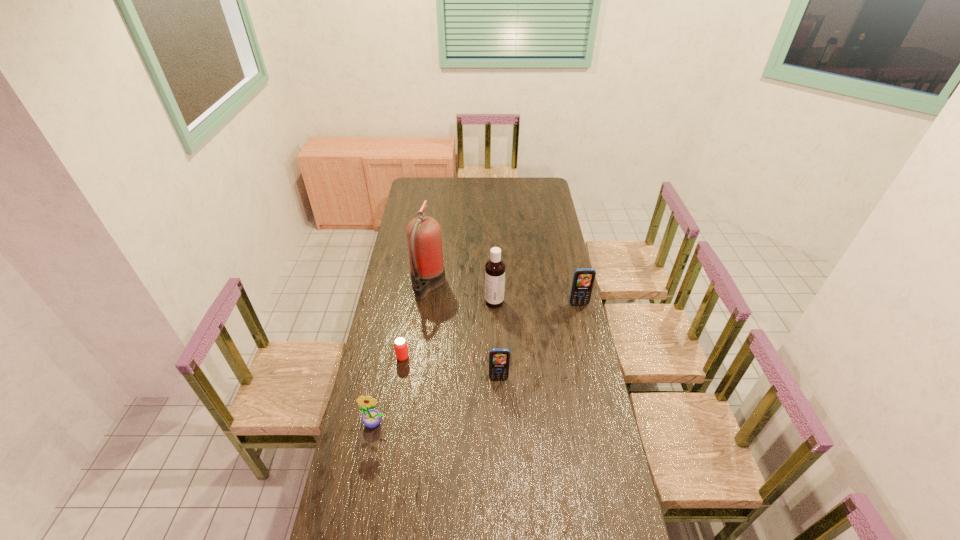
Where is `the shorter cellular telephone`? The width and height of the screenshot is (960, 540). the shorter cellular telephone is located at coordinates (499, 358).

Find the location of a particular element. the second nearest object is located at coordinates click(499, 358).

Where is `the farther cellular telephone`? This screenshot has height=540, width=960. the farther cellular telephone is located at coordinates (583, 280).

You are a GUI agent. You are given a task and a screenshot of the screen. Output one action in this format:
    pyautogui.click(x=<x>, y=<y>)
    Task: Click on the taller cellular telephone
    
    Given the screenshot: What is the action you would take?
    pyautogui.click(x=583, y=280)

At what (x,y) coordinates should I click in order to perform the action: click on dishwasher detergent. Please return your answer as a coordinate pair (x, y). This screenshot has height=540, width=960. Looking at the image, I should click on (495, 267).

This screenshot has width=960, height=540. What are the coordinates of `fire extinguisher` in the screenshot? It's located at (424, 240).

I want to click on the nearest object, so click(x=371, y=418).

Find the location of a particular element. the fourth farthest object is located at coordinates (400, 344).

Locate an element on the screen. This screenshot has width=960, height=540. the shortest object is located at coordinates (400, 344).

The image size is (960, 540). I want to click on vacant position located 0.170m on the screen of the shorter cellular telephone, so click(x=500, y=420).